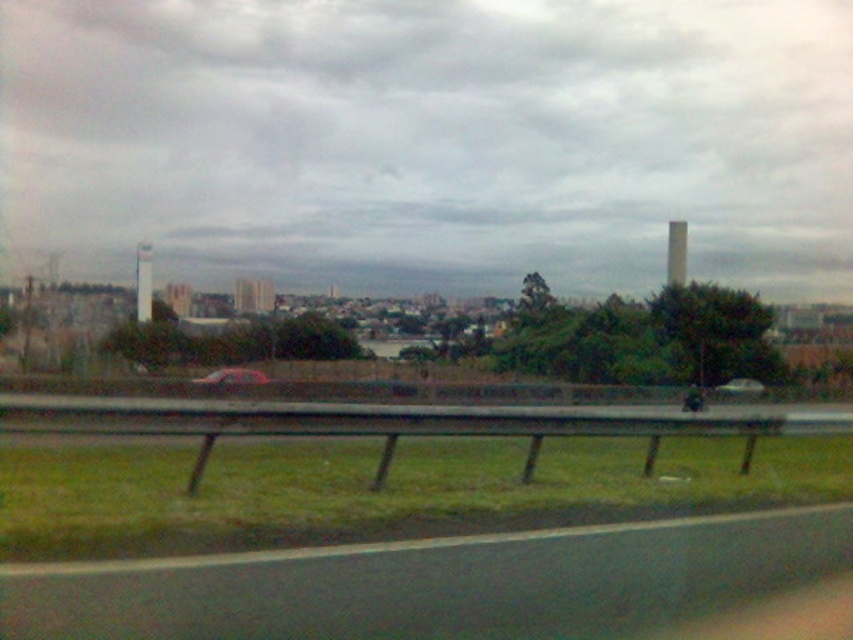
Question: Can you confirm if metallic silver car at center is smaller than metallic silver sedan at center?

Choices:
 (A) no
 (B) yes

Answer: (A)

Question: Which point is closer to the camera?

Choices:
 (A) black asphalt highway at lower center
 (B) metallic silver sedan at center

Answer: (A)

Question: Does black asphalt highway at lower center have a smaller size compared to metallic silver car at center?

Choices:
 (A) no
 (B) yes

Answer: (B)

Question: Which is nearer to the metallic silver sedan at center?

Choices:
 (A) metallic silver car at center
 (B) black asphalt highway at lower center

Answer: (A)

Question: Is black asphalt highway at lower center in front of metallic silver car at center?

Choices:
 (A) no
 (B) yes

Answer: (B)

Question: Among these objects, which one is farthest from the camera?

Choices:
 (A) black asphalt highway at lower center
 (B) metallic silver car at center

Answer: (B)